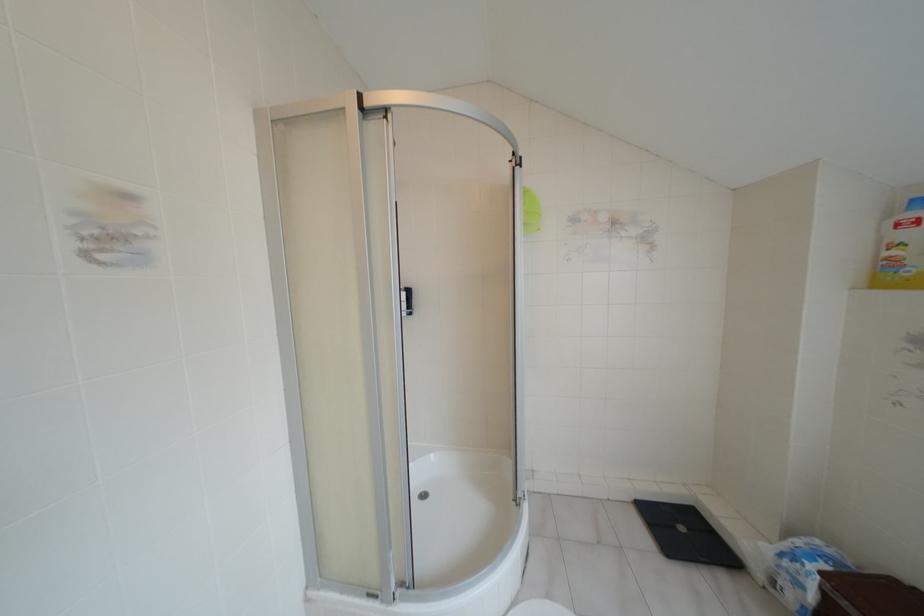
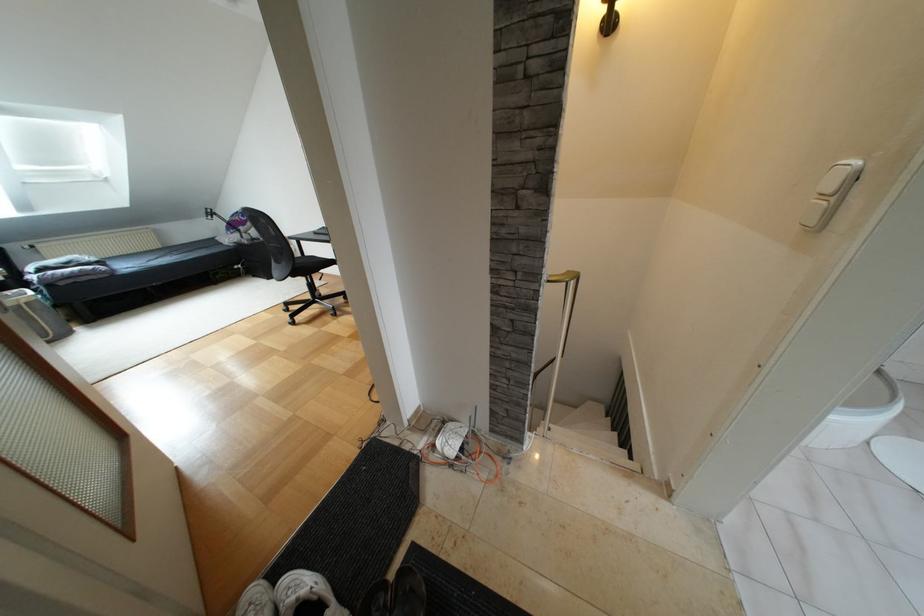
Question: What movement of the cameraman would produce the second image?

Choices:
 (A) Left
 (B) Right
 (C) Forward
 (D) Backward

Answer: (A)